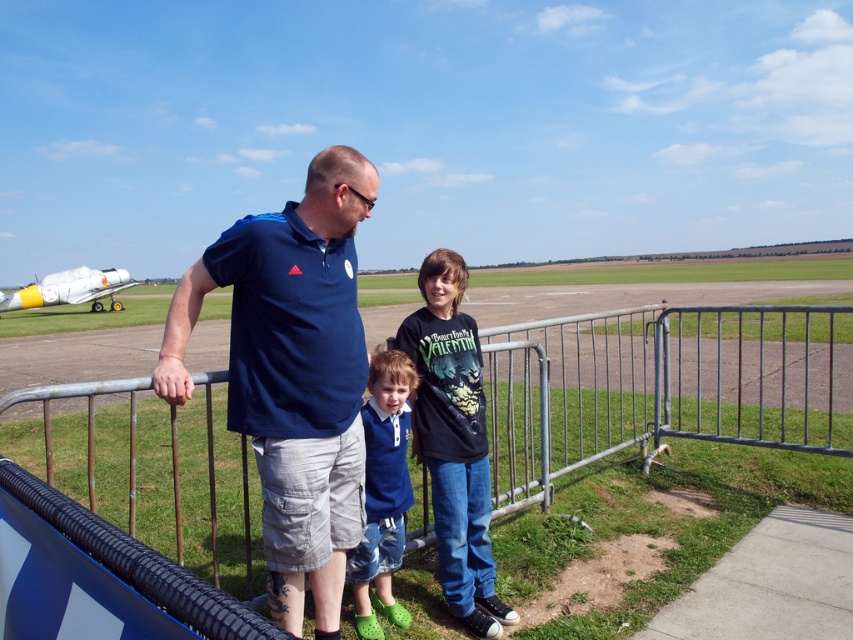
Does metallic silver fence at center lie behind matte blue shirt at center?

That is True.

Is metallic silver fence at center shorter than matte blue shirt at center?

Indeed, metallic silver fence at center has a lesser height compared to matte blue shirt at center.

Is point (780, 396) behind point (340, 372)?

Yes, it is behind point (340, 372).

This screenshot has width=853, height=640. I want to click on metallic silver fence at center, so click(x=663, y=385).

Does point (457, 616) come closer to viewer compared to point (1, 292)?

Yes, it is.

Between point (485, 579) and point (41, 280), which one is positioned behind?

Point (41, 280)

Which is behind, point (457, 512) or point (86, 289)?

The point (86, 289) is more distant.

At what (x,y) coordinates should I click in order to perform the action: click on black matte shirt at center. Please return your answer as a coordinate pair (x, y). The height and width of the screenshot is (640, 853). Looking at the image, I should click on (454, 442).

Does metallic silver fence at center have a greater width compared to white glossy airplane at left?

Indeed, metallic silver fence at center has a greater width compared to white glossy airplane at left.

Is point (640, 420) closer to viewer compared to point (102, 275)?

Yes.

Who is more forward, (579, 442) or (113, 269)?

Positioned in front is point (579, 442).

Locate an element on the screen. metallic silver fence at center is located at coordinates pyautogui.click(x=663, y=385).